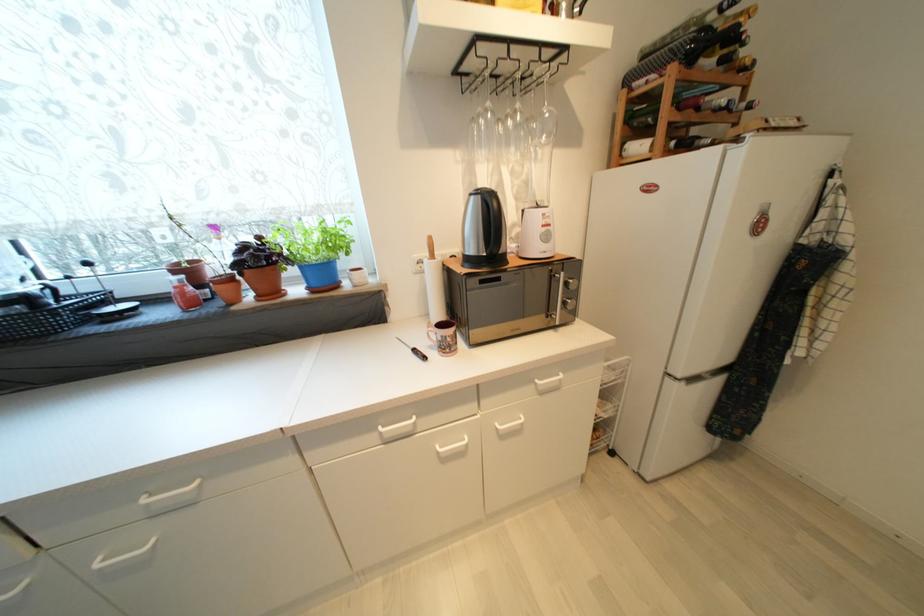
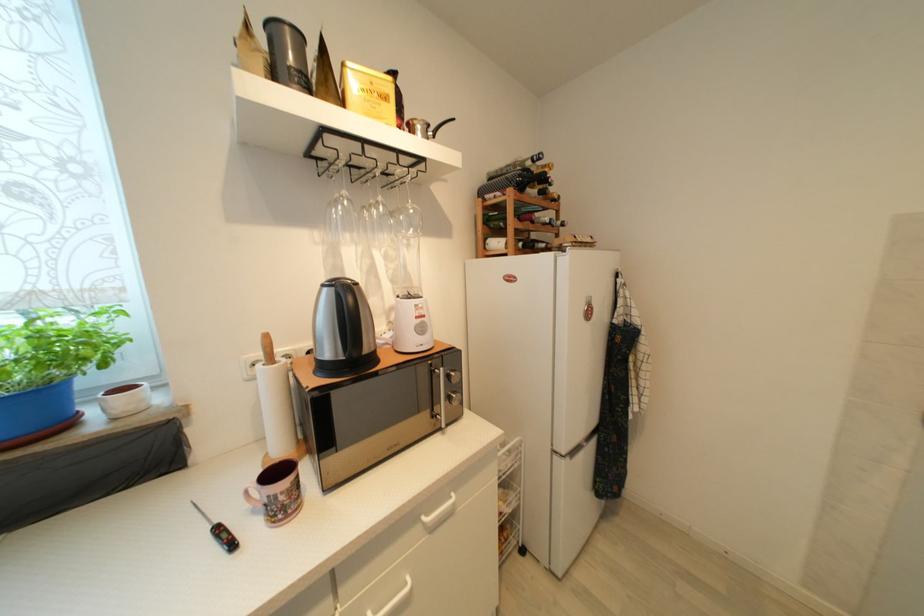
Find the pixel in the second image that matches pixel 691 26 in the first image.

(518, 166)